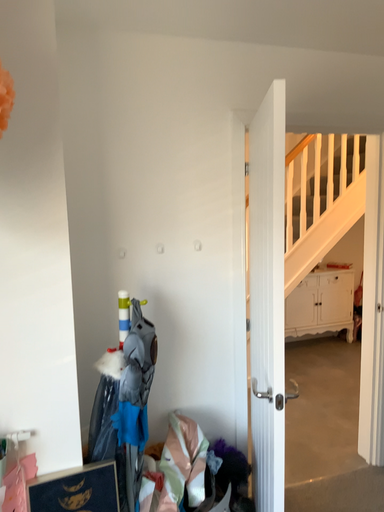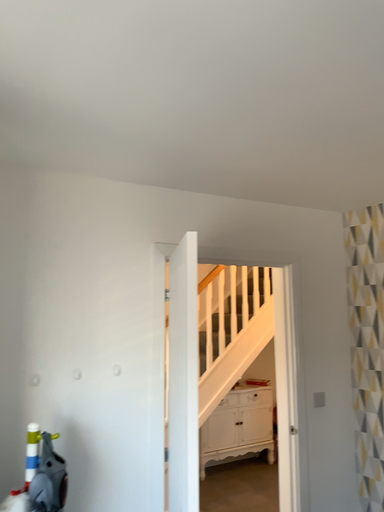
Question: Which way did the camera rotate in the video?

Choices:
 (A) rotated left
 (B) rotated right

Answer: (B)